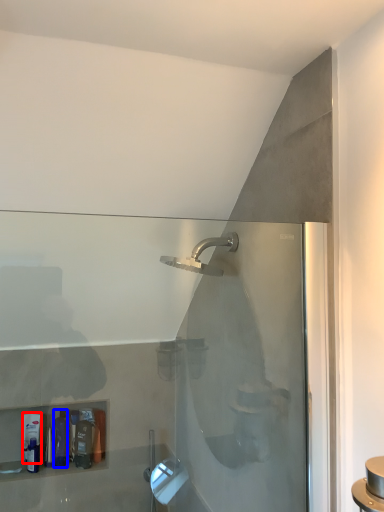
Question: Which object appears closest to the camera in this image, toiletry (highlighted by a red box) or toiletry (highlighted by a blue box)?

Choices:
 (A) toiletry
 (B) toiletry

Answer: (B)